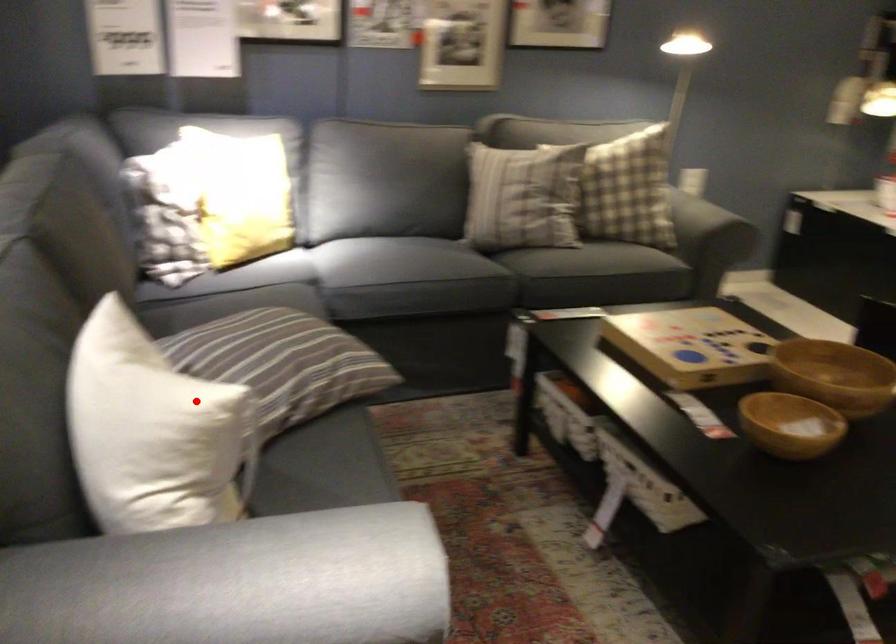
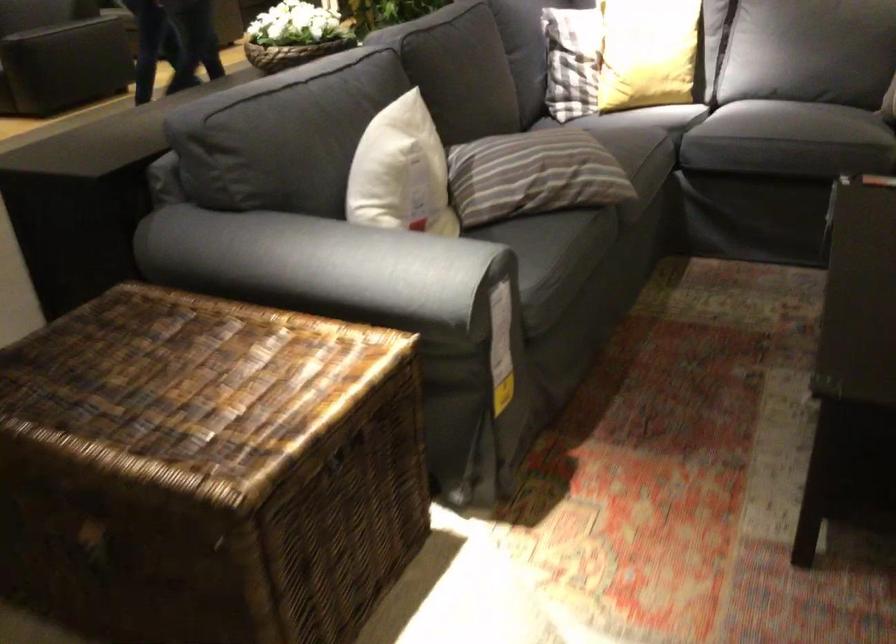
Locate, in the second image, the point that corresponds to the highlighted location in the first image.

(401, 172)